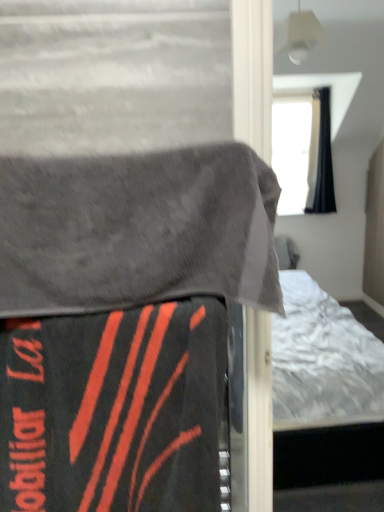
Question: Considering the relative sizes of black matte blanket at lower left, positioned as the second blanket in top-to-bottom order, and gray fabric blanket at upper left, the first blanket in the top-to-bottom sequence, in the image provided, is black matte blanket at lower left, positioned as the second blanket in top-to-bottom order, taller than gray fabric blanket at upper left, the first blanket in the top-to-bottom sequence,?

Choices:
 (A) no
 (B) yes

Answer: (B)

Question: Can you confirm if black matte blanket at lower left, positioned as the second blanket in top-to-bottom order, is smaller than gray fabric blanket at upper left, the first blanket in the top-to-bottom sequence?

Choices:
 (A) no
 (B) yes

Answer: (B)

Question: Can you confirm if black matte blanket at lower left, the 1th blanket from the bottom, is thinner than gray fabric blanket at upper left, placed as the 2th blanket when sorted from bottom to top?

Choices:
 (A) no
 (B) yes

Answer: (B)

Question: Is black matte blanket at lower left, positioned as the second blanket in top-to-bottom order, facing away from gray fabric blanket at upper left, the first blanket in the top-to-bottom sequence?

Choices:
 (A) yes
 (B) no

Answer: (B)

Question: From the image's perspective, is black matte blanket at lower left, the 1th blanket from the bottom, below gray fabric blanket at upper left, placed as the 2th blanket when sorted from bottom to top?

Choices:
 (A) yes
 (B) no

Answer: (A)

Question: Considering the positions of point (105, 166) and point (185, 313), is point (105, 166) closer or farther from the camera than point (185, 313)?

Choices:
 (A) closer
 (B) farther

Answer: (A)

Question: From a real-world perspective, is gray fabric blanket at upper left, placed as the 2th blanket when sorted from bottom to top, above or below velvet-like black bed at center?

Choices:
 (A) above
 (B) below

Answer: (A)

Question: Looking at the image, does gray fabric blanket at upper left, placed as the 2th blanket when sorted from bottom to top, seem bigger or smaller compared to velvet-like black bed at center?

Choices:
 (A) small
 (B) big

Answer: (A)

Question: Which is correct: gray fabric blanket at upper left, the first blanket in the top-to-bottom sequence, is inside velvet-like black bed at center, or outside of it?

Choices:
 (A) outside
 (B) inside

Answer: (B)

Question: Considering the positions of velvet-like black bed at center and gray fabric blanket at upper left, the first blanket in the top-to-bottom sequence, in the image, is velvet-like black bed at center bigger or smaller than gray fabric blanket at upper left, the first blanket in the top-to-bottom sequence,?

Choices:
 (A) big
 (B) small

Answer: (A)

Question: From a real-world perspective, is velvet-like black bed at center above or below gray fabric blanket at upper left, placed as the 2th blanket when sorted from bottom to top?

Choices:
 (A) below
 (B) above

Answer: (A)

Question: From their relative heights in the image, would you say velvet-like black bed at center is taller or shorter than gray fabric blanket at upper left, placed as the 2th blanket when sorted from bottom to top?

Choices:
 (A) tall
 (B) short

Answer: (A)

Question: Is point (266, 236) closer or farther from the camera than point (198, 221)?

Choices:
 (A) farther
 (B) closer

Answer: (B)

Question: Looking at the image, does gray fabric blanket at upper left, placed as the 2th blanket when sorted from bottom to top, seem bigger or smaller compared to black matte blanket at lower left, the 1th blanket from the bottom?

Choices:
 (A) small
 (B) big

Answer: (B)

Question: From a real-world perspective, is gray fabric blanket at upper left, placed as the 2th blanket when sorted from bottom to top, positioned above or below black matte blanket at lower left, the 1th blanket from the bottom?

Choices:
 (A) above
 (B) below

Answer: (A)